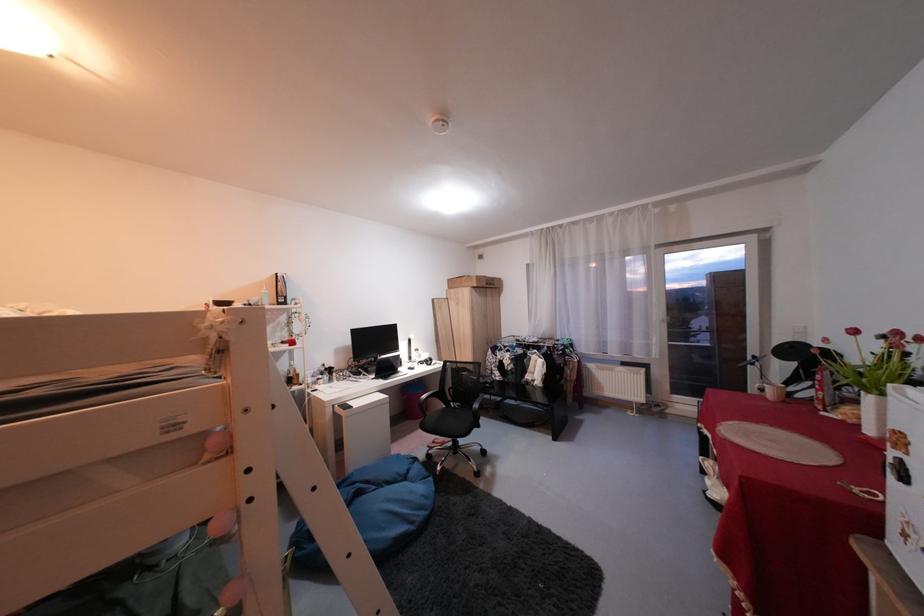
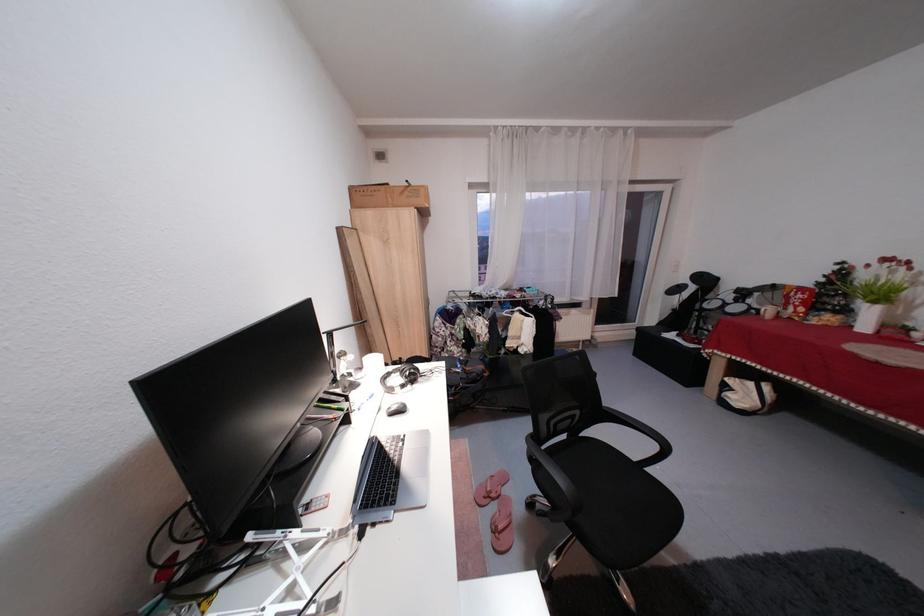
The point at (x=480, y=278) is marked in the first image. Where is the corresponding point in the second image?

(420, 185)